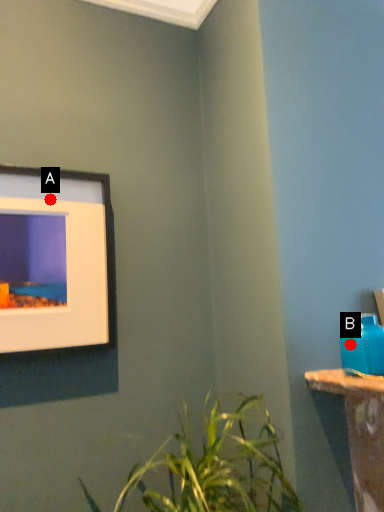
Question: Two points are circled on the image, labeled by A and B beside each circle. Which point is closer to the camera?

Choices:
 (A) A is closer
 (B) B is closer

Answer: (B)